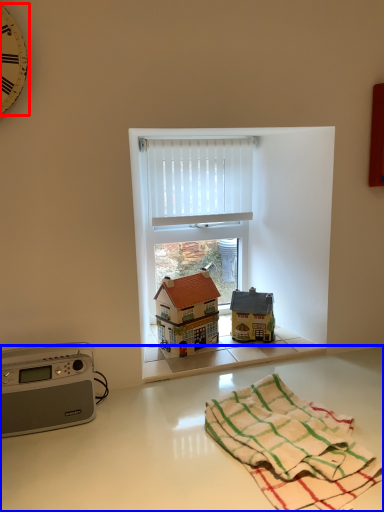
Question: Which object appears closest to the camera in this image, clock (highlighted by a red box) or counter top (highlighted by a blue box)?

Choices:
 (A) clock
 (B) counter top

Answer: (B)